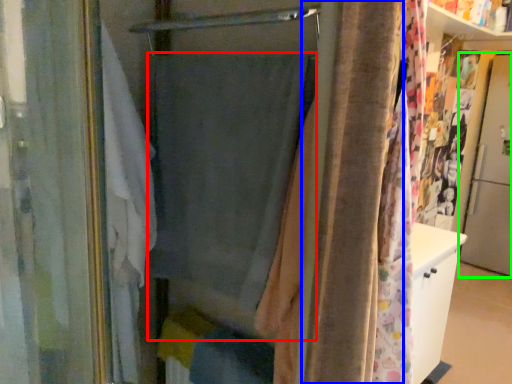
Question: Which is nearer to the curtain (highlighted by a red box)? shower curtain (highlighted by a blue box) or screen door (highlighted by a green box).

Choices:
 (A) shower curtain
 (B) screen door

Answer: (A)